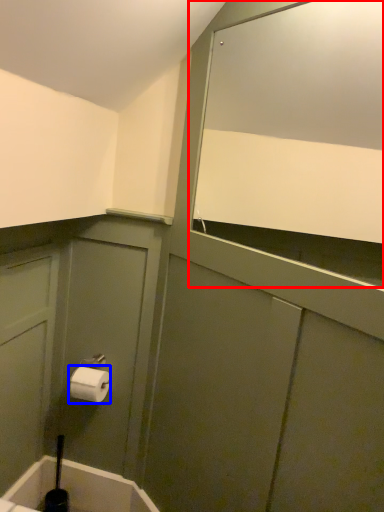
Question: Which object is further to the camera taking this photo, mirror (highlighted by a red box) or toilet paper (highlighted by a blue box)?

Choices:
 (A) mirror
 (B) toilet paper

Answer: (B)